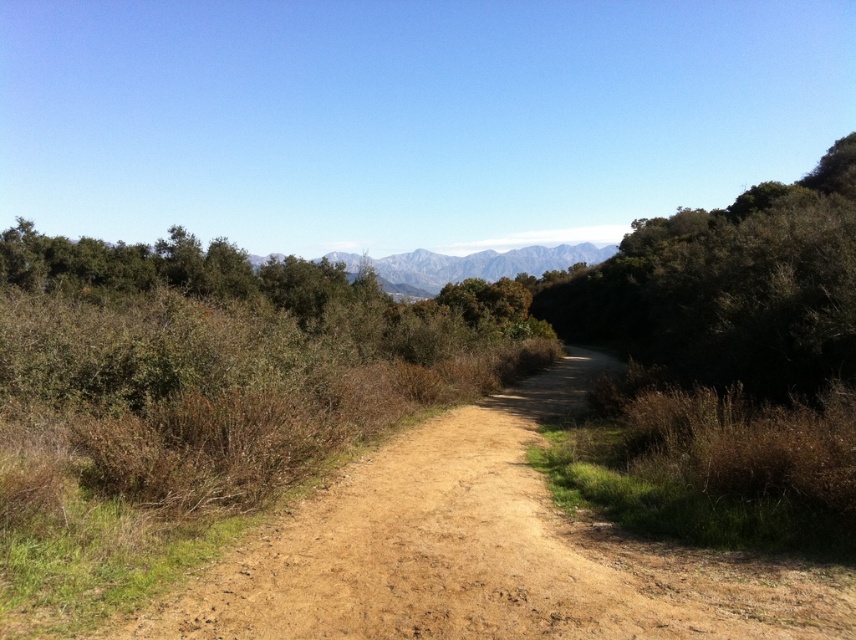
Is point (806, 605) positioned in front of point (400, 289)?

That is True.

Can you confirm if dried dirt path at center is smaller than gray rocky mountains at center?

Yes, dried dirt path at center is smaller than gray rocky mountains at center.

This screenshot has width=856, height=640. What do you see at coordinates (483, 552) in the screenshot? I see `dried dirt path at center` at bounding box center [483, 552].

The width and height of the screenshot is (856, 640). In order to click on dried dirt path at center in this screenshot , I will do `click(483, 552)`.